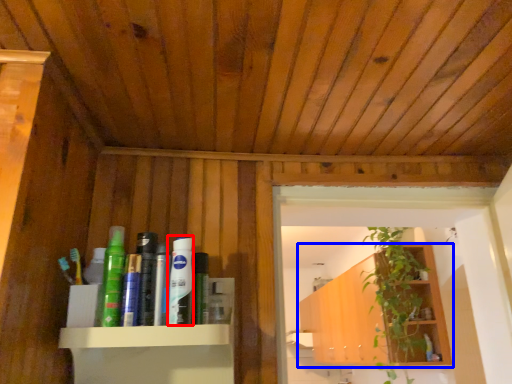
Question: Which object is closer to the camera taking this photo, toiletry (highlighted by a red box) or shelf (highlighted by a blue box)?

Choices:
 (A) toiletry
 (B) shelf

Answer: (A)